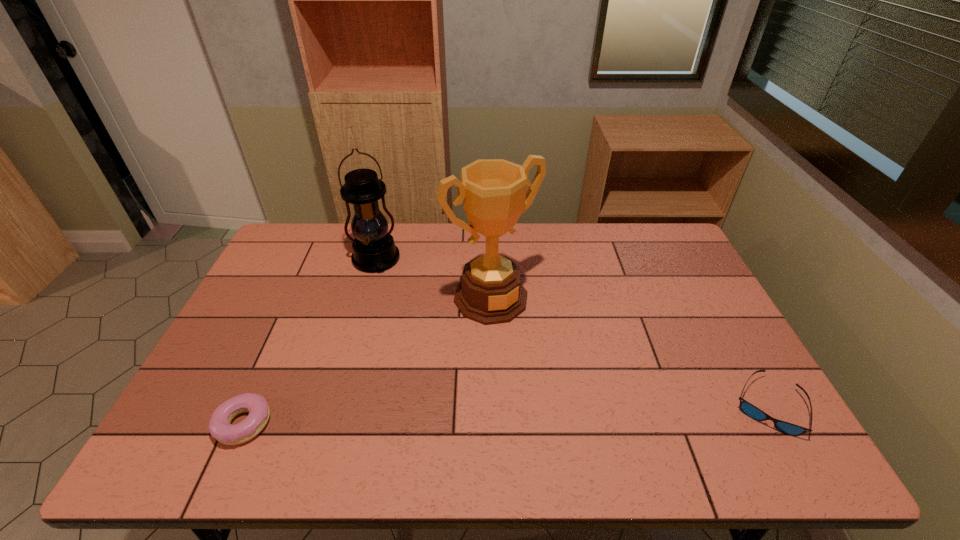
Where is `free space that is in between the second object from right to left and the leftmost object`? This screenshot has height=540, width=960. free space that is in between the second object from right to left and the leftmost object is located at coordinates (368, 361).

Find the location of a particular element. vacant area that lies between the second tallest object and the rightmost object is located at coordinates (572, 333).

Where is `free space between the award and the second object from left to right`? This screenshot has height=540, width=960. free space between the award and the second object from left to right is located at coordinates (433, 279).

The width and height of the screenshot is (960, 540). I want to click on empty space that is in between the second object from left to right and the award, so click(x=433, y=279).

Image resolution: width=960 pixels, height=540 pixels. Identify the location of free space that is in between the leftmost object and the lantern. (310, 341).

I want to click on unoccupied position between the third object from right to left and the leftmost object, so click(x=310, y=341).

The height and width of the screenshot is (540, 960). Find the location of `object that stands as the third closest to the second tallest object`. object that stands as the third closest to the second tallest object is located at coordinates (747, 408).

Locate an element on the screen. The image size is (960, 540). the closest object relative to the award is located at coordinates (374, 250).

Locate an element on the screen. Image resolution: width=960 pixels, height=540 pixels. free space that satisfies the following two spatial constraints: 1. on the front side of the award; 2. on the right side of the third object from right to left is located at coordinates (365, 298).